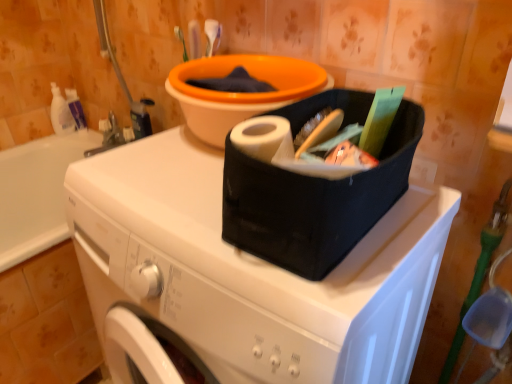
Question: Could you tell me if white matte washing machine at center is facing white plastic bottle at upper left, which is the 2th cleaning product in left-to-right order?

Choices:
 (A) yes
 (B) no

Answer: (B)

Question: From a real-world perspective, is white matte washing machine at center over white plastic bottle at upper left, marked as the 1th cleaning product in a right-to-left arrangement?

Choices:
 (A) yes
 (B) no

Answer: (B)

Question: Is white matte washing machine at center not within white plastic bottle at upper left, which is the 2th cleaning product in left-to-right order?

Choices:
 (A) yes
 (B) no

Answer: (A)

Question: Considering the relative positions of white matte washing machine at center and white plastic bottle at upper left, which is the 2th cleaning product in left-to-right order, in the image provided, is white matte washing machine at center in front of white plastic bottle at upper left, which is the 2th cleaning product in left-to-right order,?

Choices:
 (A) no
 (B) yes

Answer: (B)

Question: From the image's perspective, is white matte washing machine at center below white plastic bottle at upper left, which is the 2th cleaning product in left-to-right order?

Choices:
 (A) no
 (B) yes

Answer: (B)

Question: Considering the relative sizes of white matte washing machine at center and white plastic bottle at upper left, which is the 2th cleaning product in left-to-right order, in the image provided, is white matte washing machine at center taller than white plastic bottle at upper left, which is the 2th cleaning product in left-to-right order,?

Choices:
 (A) yes
 (B) no

Answer: (A)

Question: Is orange plastic basin at upper center positioned behind white matte washing machine at center?

Choices:
 (A) yes
 (B) no

Answer: (A)

Question: Considering the relative positions of orange plastic basin at upper center and white matte washing machine at center in the image provided, is orange plastic basin at upper center to the left of white matte washing machine at center from the viewer's perspective?

Choices:
 (A) no
 (B) yes

Answer: (A)

Question: From the image's perspective, would you say orange plastic basin at upper center is positioned over white matte washing machine at center?

Choices:
 (A) no
 (B) yes

Answer: (B)

Question: Considering the relative sizes of orange plastic basin at upper center and white matte washing machine at center in the image provided, is orange plastic basin at upper center shorter than white matte washing machine at center?

Choices:
 (A) yes
 (B) no

Answer: (A)

Question: Is orange plastic basin at upper center to the right of white matte washing machine at center from the viewer's perspective?

Choices:
 (A) yes
 (B) no

Answer: (A)

Question: Considering the relative sizes of orange plastic basin at upper center and white matte washing machine at center in the image provided, is orange plastic basin at upper center wider than white matte washing machine at center?

Choices:
 (A) yes
 (B) no

Answer: (B)

Question: Is white glossy bottle at left, marked as the 1th cleaning product in a left-to-right arrangement, to the right of white matte washing machine at center from the viewer's perspective?

Choices:
 (A) yes
 (B) no

Answer: (B)